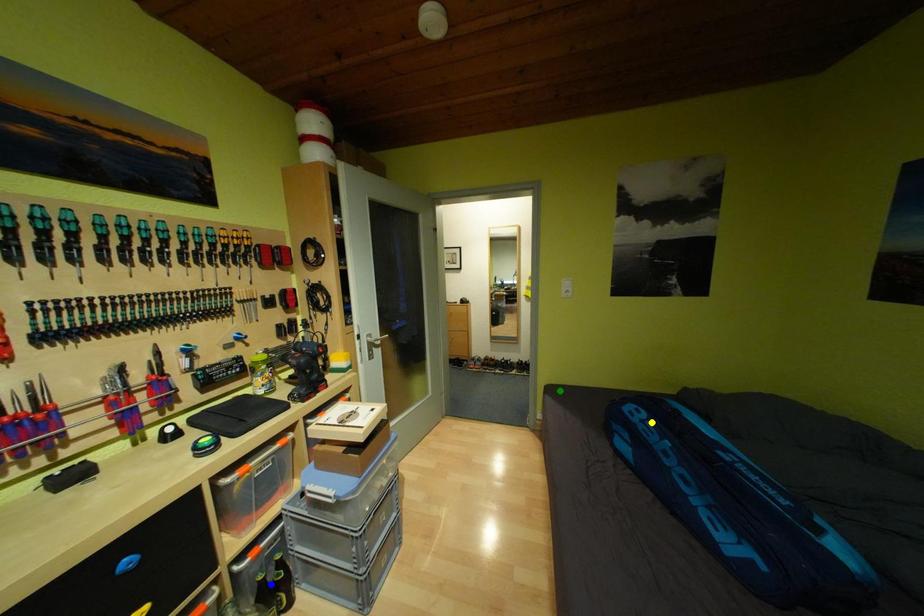
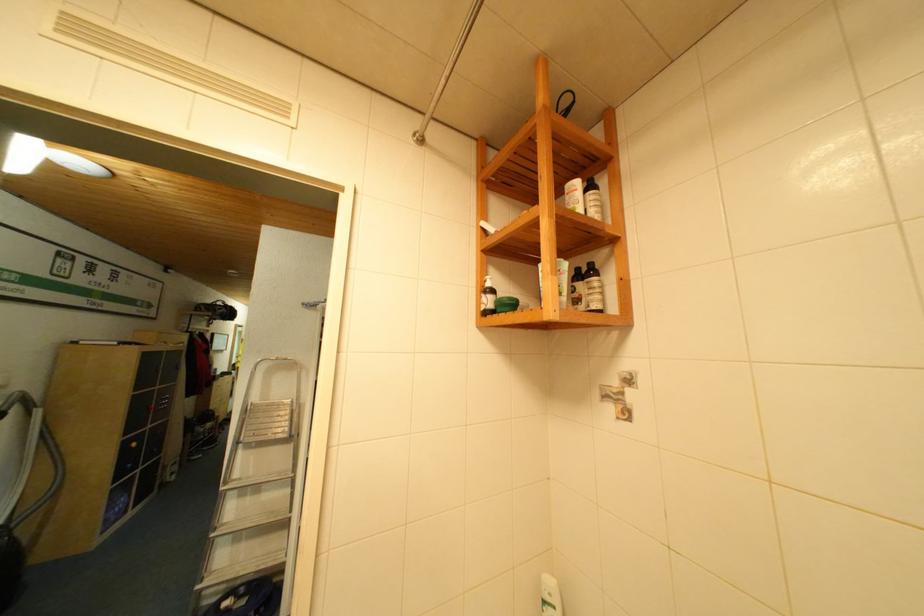
I am providing you with two images of the same scene from different viewpoints. Three points are marked in image1. Which point corresponds to a part or object that is occluded in image2?In image1, three points are marked. Which of them correspond to a part or object that is occluded in image2?Among the three points shown in image1, which one corresponds to a part or object that is no longer visible due to occlusion in image2?

Invisible in image2: green point, blue point, yellow point.